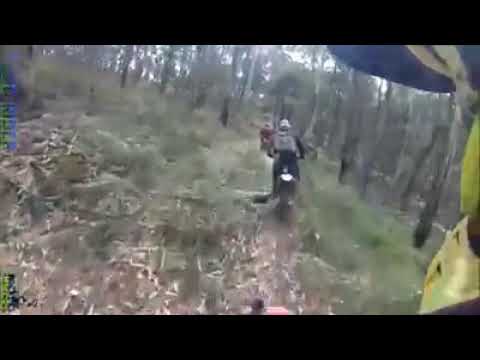
Where is `light`? This screenshot has height=360, width=480. light is located at coordinates (286, 178).